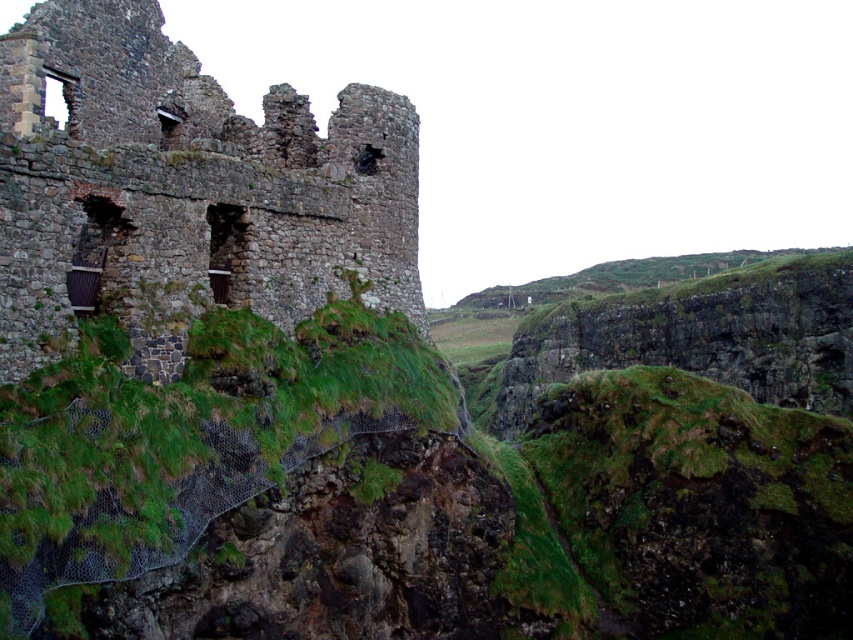
Does point (254, 259) come farther from viewer compared to point (151, 516)?

Yes, it is behind point (151, 516).

Is rusty stone castle at upper left smaller than green grass at center?

No, rusty stone castle at upper left is not smaller than green grass at center.

What do you see at coordinates (183, 189) in the screenshot? I see `rusty stone castle at upper left` at bounding box center [183, 189].

Locate an element on the screen. This screenshot has height=640, width=853. rusty stone castle at upper left is located at coordinates (183, 189).